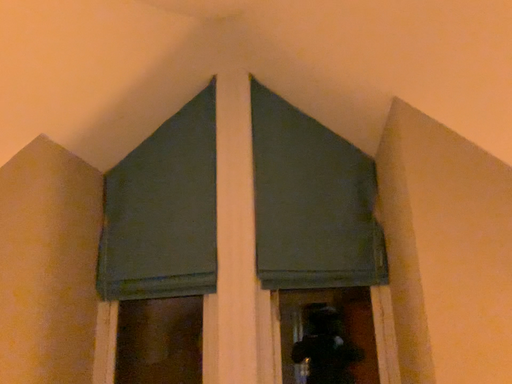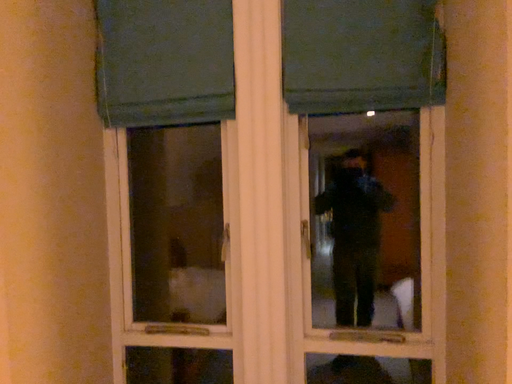
Question: Which way did the camera rotate in the video?

Choices:
 (A) rotated upward
 (B) rotated downward

Answer: (B)